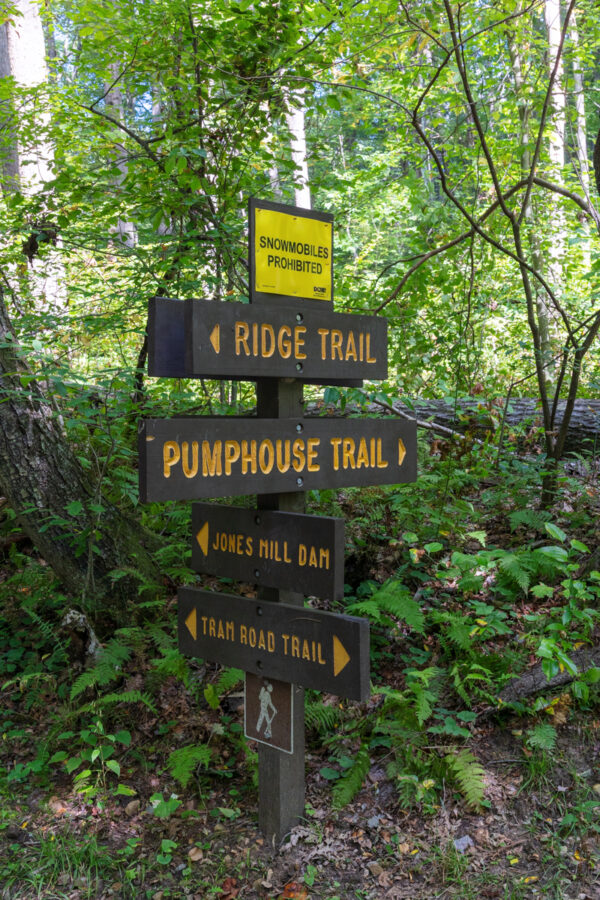
Identify the location of light. The height and width of the screenshot is (900, 600). (514, 328).